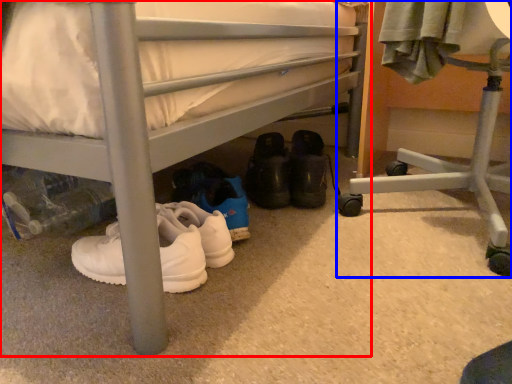
Question: Which object appears closest to the camera in this image, bed (highlighted by a red box) or furniture (highlighted by a blue box)?

Choices:
 (A) bed
 (B) furniture

Answer: (A)